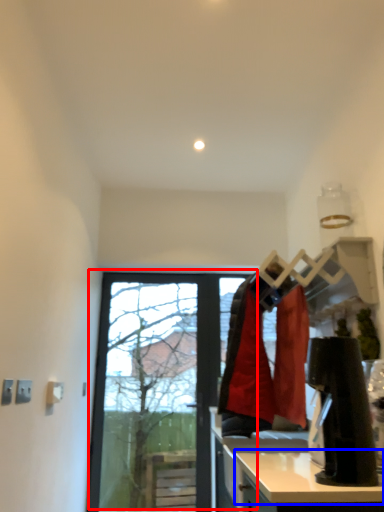
Question: Which object is closer to the camera taking this photo, window (highlighted by a red box) or counter top (highlighted by a blue box)?

Choices:
 (A) window
 (B) counter top

Answer: (B)